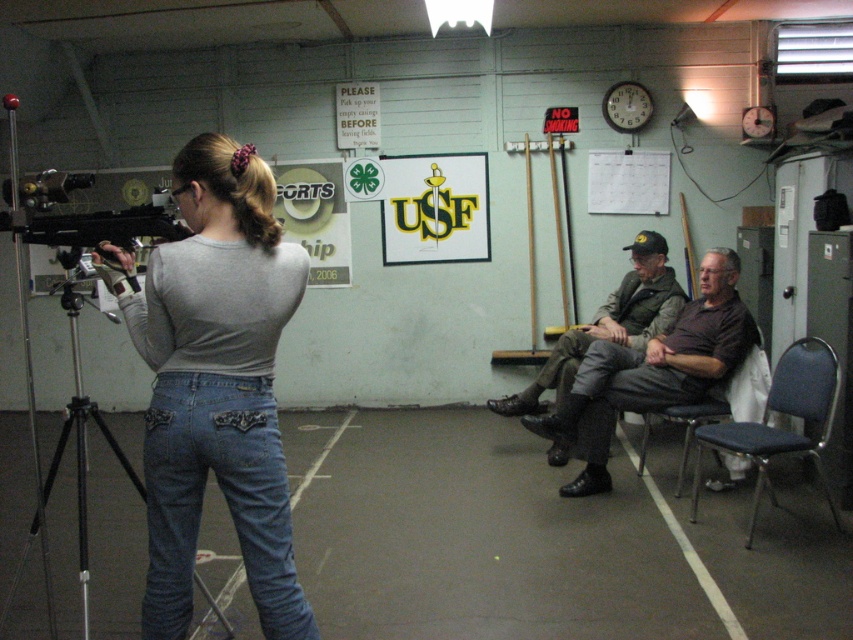
Does blue padded chair at right appear on the left side of black matte tripod at center?

Incorrect, blue padded chair at right is not on the left side of black matte tripod at center.

Between point (790, 358) and point (82, 397), which one is positioned behind?

Point (82, 397)

Where is `blue padded chair at right`? blue padded chair at right is located at coordinates (781, 428).

Who is taller, denim jeans at center or denim at right?

denim jeans at center

Who is positioned more to the left, denim jeans at center or denim at right?

Positioned to the left is denim jeans at center.

This screenshot has width=853, height=640. What do you see at coordinates (218, 385) in the screenshot?
I see `denim jeans at center` at bounding box center [218, 385].

Locate an element on the screen. Image resolution: width=853 pixels, height=640 pixels. denim jeans at center is located at coordinates (218, 385).

Between blue padded chair at right and denim at right, which one appears on the left side from the viewer's perspective?

Positioned to the left is denim at right.

Looking at this image, is blue padded chair at right closer to the viewer compared to denim at right?

Yes, blue padded chair at right is closer to the viewer.

Does point (787, 436) come in front of point (589, 408)?

That is True.

Image resolution: width=853 pixels, height=640 pixels. I want to click on blue padded chair at right, so click(x=781, y=428).